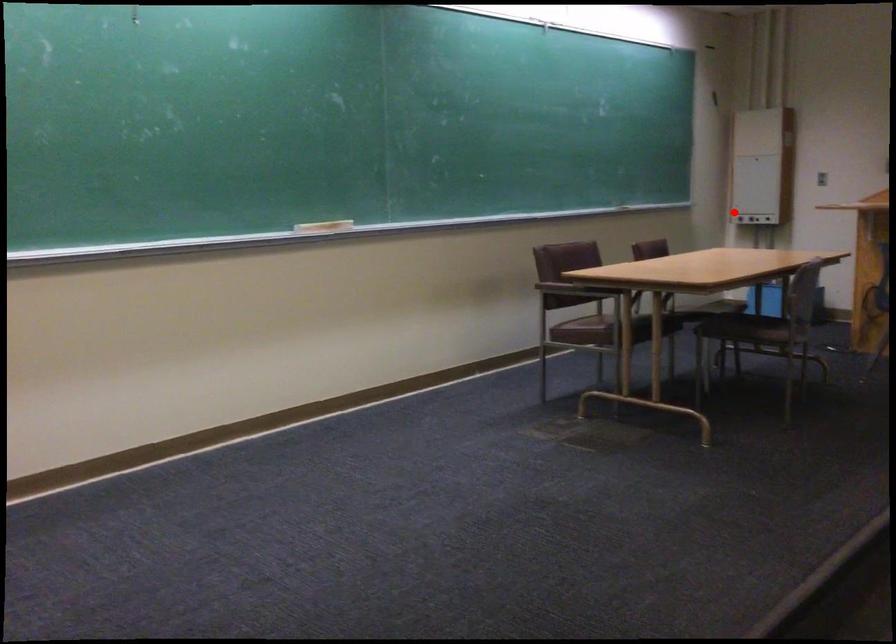
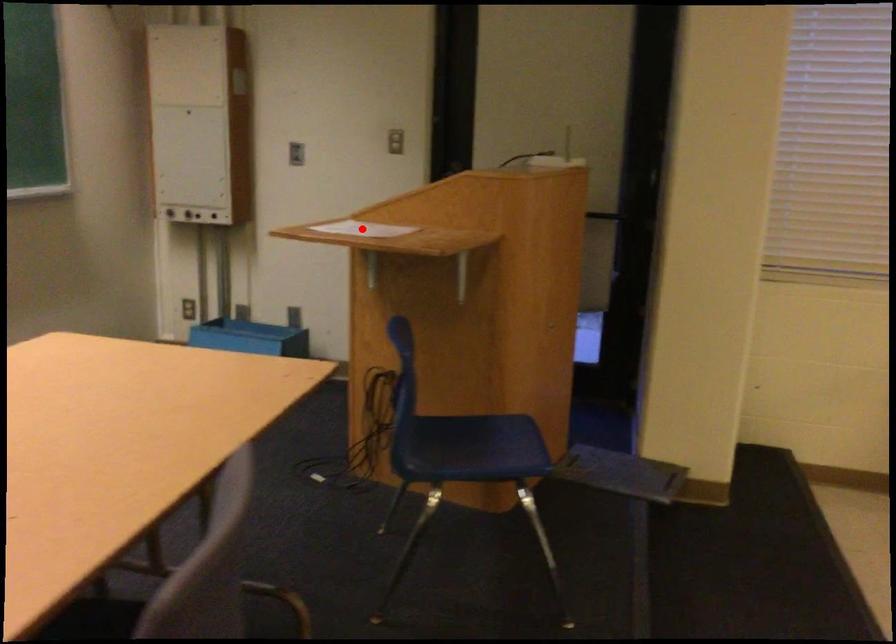
I am providing you with two images of the same scene from different viewpoints. A red point is marked on the first image and another point is marked on the second image. Does the point marked in image1 correspond to the same location as the one in image2?

No